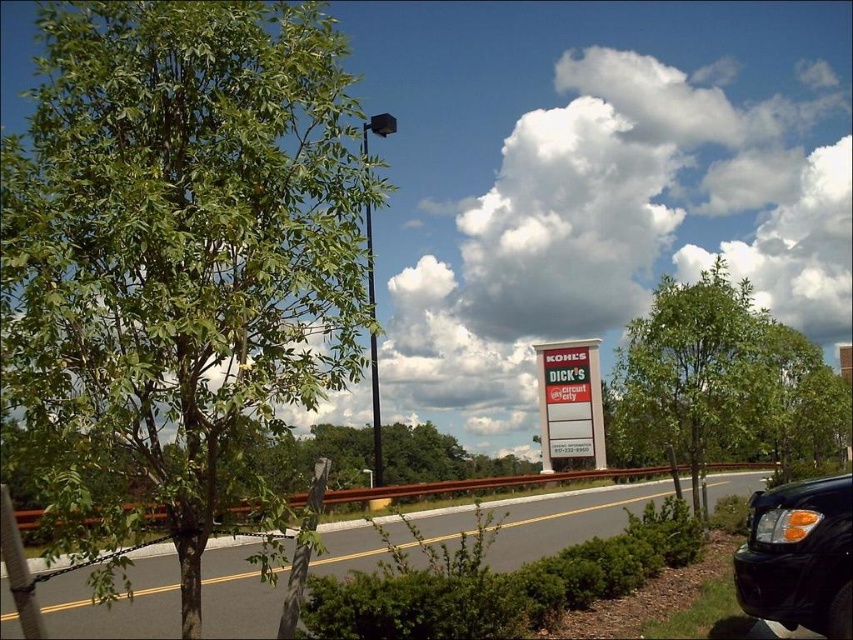
Can you confirm if asphalt road at center is shorter than red plastic sign at center?

In fact, asphalt road at center may be taller than red plastic sign at center.

Is asphalt road at center to the left of red plastic sign at center from the viewer's perspective?

Indeed, asphalt road at center is positioned on the left side of red plastic sign at center.

Is point (16, 618) positioned in front of point (579, 364)?

That is True.

This screenshot has width=853, height=640. I want to click on asphalt road at center, so click(566, 520).

You are a GUI agent. You are given a task and a screenshot of the screen. Output one action in this format:
    pyautogui.click(x=<x>, y=<y>)
    Task: Click on the green leafy tree at left
    The width and height of the screenshot is (853, 640).
    Given the screenshot: What is the action you would take?
    pyautogui.click(x=183, y=240)

Measure the distance between green leafy tree at left and camera.

2.48 meters

Image resolution: width=853 pixels, height=640 pixels. I want to click on green leafy tree at left, so click(183, 240).

Is green leafy tree at left smaller than green leafy tree at center?

Indeed, green leafy tree at left has a smaller size compared to green leafy tree at center.

Describe the element at coordinates (183, 240) in the screenshot. The width and height of the screenshot is (853, 640). I see `green leafy tree at left` at that location.

Find the location of a particular element. The image size is (853, 640). green leafy tree at left is located at coordinates (183, 240).